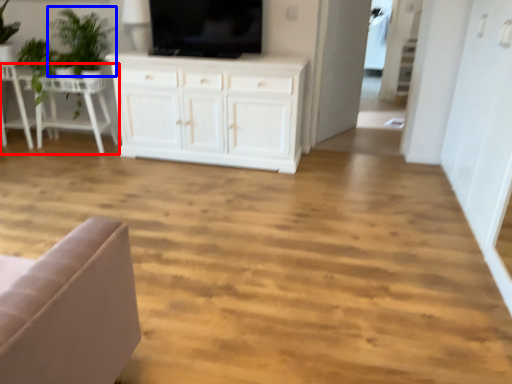
Question: Which object is further to the camera taking this photo, table (highlighted by a red box) or plant (highlighted by a blue box)?

Choices:
 (A) table
 (B) plant

Answer: (A)